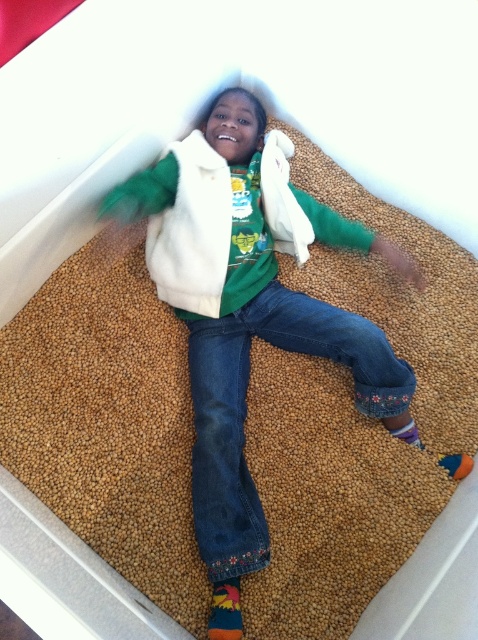
You are a photographer setting up a shot of the child in the sensory bin. You need to adjust the focus so that both the white fleece jacket at center and the denim at center are in sharp focus. Which object should you focus on to ensure both are clear?

You should focus on the white fleece jacket at center because it is closer to the viewer than the denim at center. By focusing on the closer object, the depth of field will extend backward, potentially keeping both in focus.

You are a photographer setting up a shoot in this scene. You need to place a small prop between the white fleece jacket at center and the denim at center. Based on their sizes, which object should the prop be placed closer to?

The white fleece jacket at center is much taller than the denim at center, so the prop should be placed closer to the denim at center to balance the visual weight.